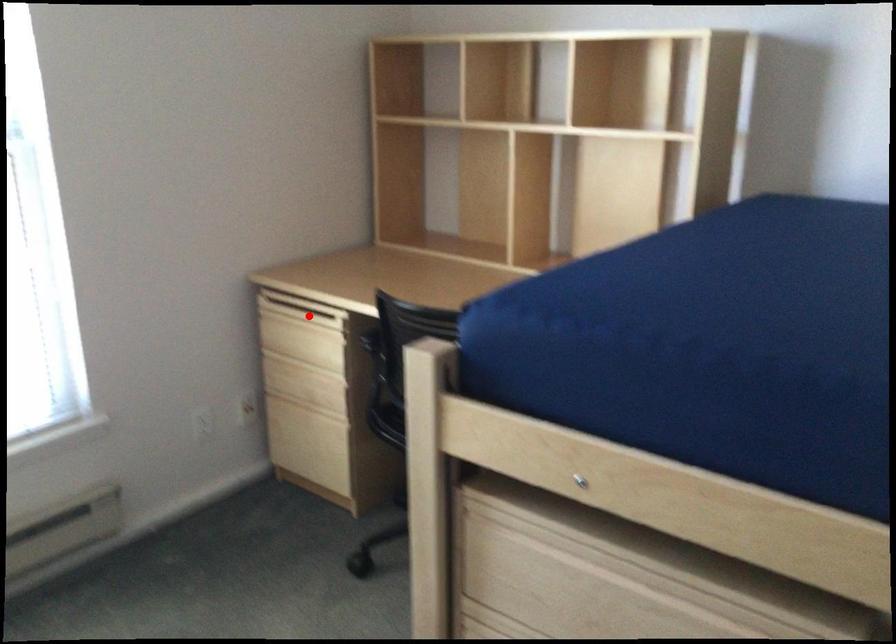
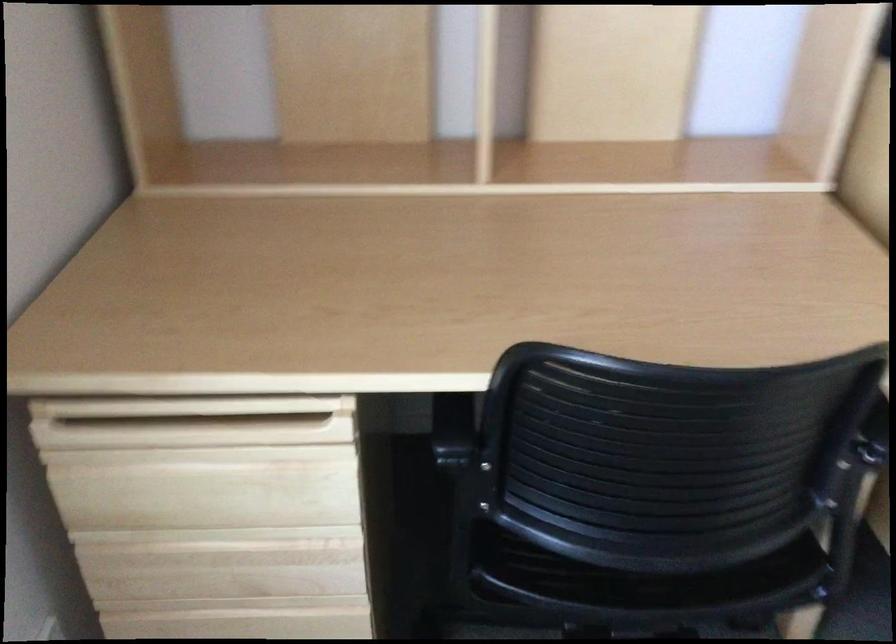
In the second image, find the point that corresponds to the highlighted location in the first image.

(192, 422)